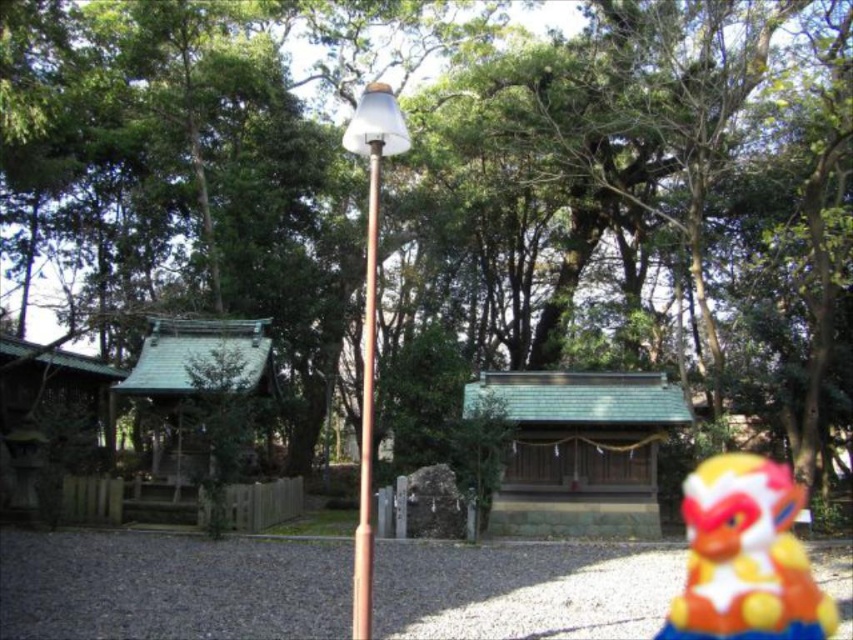
Does point (368, 476) lie behind point (372, 145)?

No, (368, 476) is closer to viewer.

Which of these two, metallic brown pole at center or copper metallic pole at center, stands shorter?

With less height is copper metallic pole at center.

Does point (366, 269) lie in front of point (370, 532)?

No, (366, 269) is behind (370, 532).

This screenshot has width=853, height=640. I want to click on metallic brown pole at center, so click(369, 317).

Consider the image. Does gray gravel at lower center appear over metallic brown pole at center?

No.

Who is more distant from viewer, (593,595) or (367,445)?

The point (593,595) is behind.

What do you see at coordinates (170, 586) in the screenshot?
I see `gray gravel at lower center` at bounding box center [170, 586].

Identify the location of gray gravel at lower center. Image resolution: width=853 pixels, height=640 pixels. 170,586.

You are a GUI agent. You are given a task and a screenshot of the screen. Output one action in this format:
    pyautogui.click(x=<x>, y=<y>)
    Task: Click on the gray gravel at lower center
    
    Given the screenshot: What is the action you would take?
    pyautogui.click(x=170, y=586)

In the scene shown: Who is higher up, gray gravel at lower center or plastic toy monkey at lower right?

gray gravel at lower center is above.

Is point (509, 547) positioned behind point (732, 509)?

No.

Identify the location of gray gravel at lower center. (170, 586).